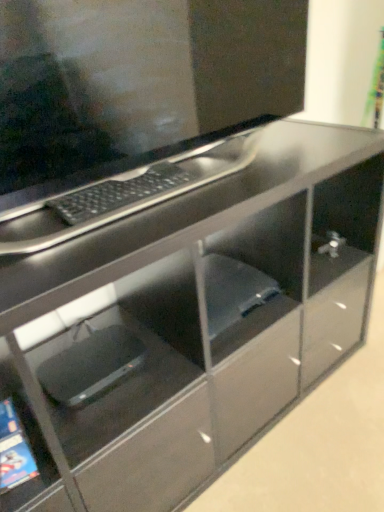
Question: Is black matte keyboard at upper center taller than black plastic laptop at lower left?

Choices:
 (A) yes
 (B) no

Answer: (B)

Question: From the image's perspective, would you say black matte keyboard at upper center is positioned over black plastic laptop at lower left?

Choices:
 (A) no
 (B) yes

Answer: (B)

Question: From the image's perspective, does black matte keyboard at upper center appear lower than black plastic laptop at lower left?

Choices:
 (A) no
 (B) yes

Answer: (A)

Question: Would you consider black matte keyboard at upper center to be distant from black plastic laptop at lower left?

Choices:
 (A) no
 (B) yes

Answer: (A)

Question: From a real-world perspective, is black matte keyboard at upper center located higher than black plastic laptop at lower left?

Choices:
 (A) yes
 (B) no

Answer: (A)

Question: Can you confirm if black matte keyboard at upper center is shorter than black plastic laptop at lower left?

Choices:
 (A) yes
 (B) no

Answer: (A)

Question: Does black plastic laptop at lower left appear on the right side of black matte keyboard at upper center?

Choices:
 (A) no
 (B) yes

Answer: (A)

Question: Is black matte keyboard at upper center at the back of black plastic laptop at lower left?

Choices:
 (A) no
 (B) yes

Answer: (A)

Question: From a real-world perspective, is black plastic laptop at lower left physically above black matte keyboard at upper center?

Choices:
 (A) yes
 (B) no

Answer: (B)

Question: From the image's perspective, is black plastic laptop at lower left located above black matte keyboard at upper center?

Choices:
 (A) yes
 (B) no

Answer: (B)

Question: Is black plastic laptop at lower left not near black matte keyboard at upper center?

Choices:
 (A) no
 (B) yes

Answer: (A)

Question: Does black plastic laptop at lower left come behind black matte keyboard at upper center?

Choices:
 (A) yes
 (B) no

Answer: (A)

Question: From a real-world perspective, is matte black monitor at upper center over black plastic laptop at lower left?

Choices:
 (A) yes
 (B) no

Answer: (A)